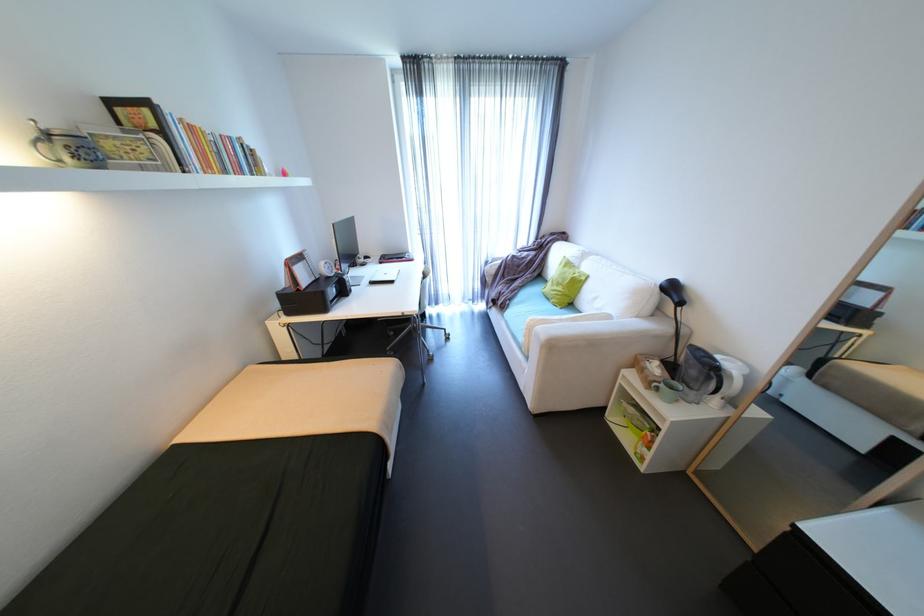
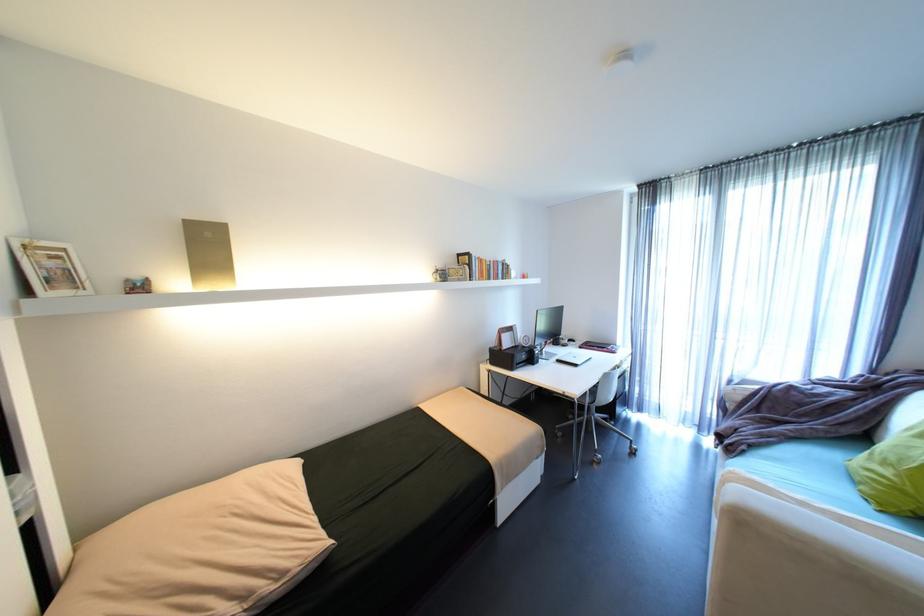
Locate, in the second image, the point that corresponds to point 341,225 in the first image.

(544, 310)